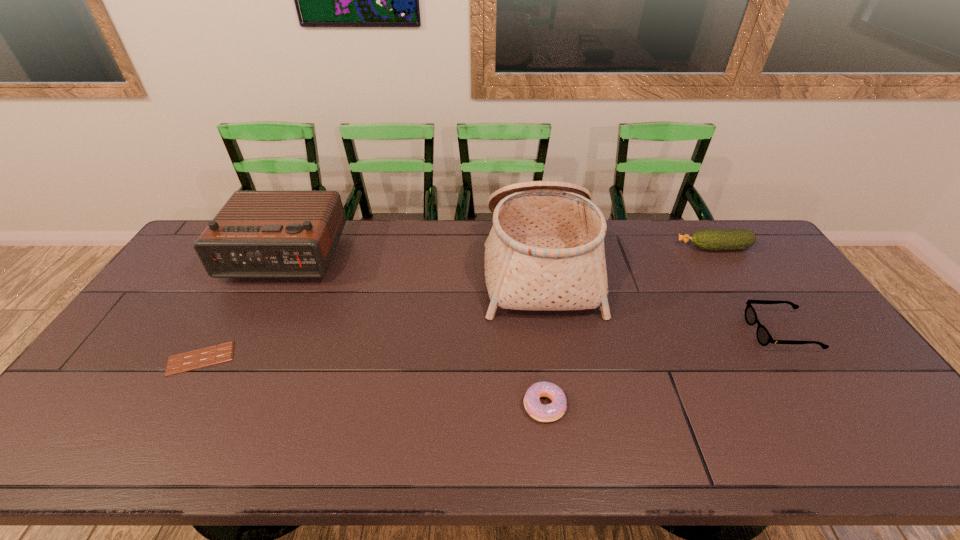
Where is `unoccupied position between the second shortest object and the chocolate bar`? unoccupied position between the second shortest object and the chocolate bar is located at coordinates (372, 382).

I want to click on vacant area between the radio receiver and the tallest object, so click(x=411, y=261).

Identify which object is the second nearest to the doughnut. Please provide its 2D coordinates. Your answer should be formatted as a tuple, i.e. [(x, y)], where the tuple contains the x and y coordinates of a point satisfying the conditions above.

[(764, 338)]

This screenshot has width=960, height=540. Find the location of `object that stands as the second closest to the fourth shortest object`. object that stands as the second closest to the fourth shortest object is located at coordinates click(545, 251).

Locate an element on the screen. vacant region that satisfies the following two spatial constraints: 1. on the arms of the third shortest object; 2. on the front side of the fifth tallest object is located at coordinates (829, 406).

This screenshot has height=540, width=960. What are the coordinates of `free space that satisfies the following two spatial constraints: 1. on the arms of the spectacles; 2. on the front side of the doughnut` in the screenshot? It's located at (829, 406).